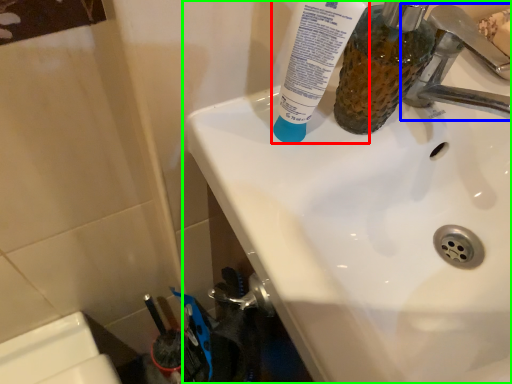
Question: Considering the real-world distances, which object is farthest from toothpaste (highlighted by a red box)? tap (highlighted by a blue box) or sink (highlighted by a green box)?

Choices:
 (A) tap
 (B) sink

Answer: (A)